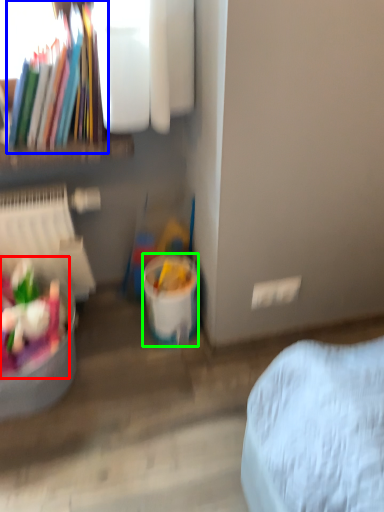
Question: Based on their relative distances, which object is farther from food (highlighted by a red box)? Choose from book (highlighted by a blue box) and bucket (highlighted by a green box).

Choices:
 (A) book
 (B) bucket

Answer: (A)